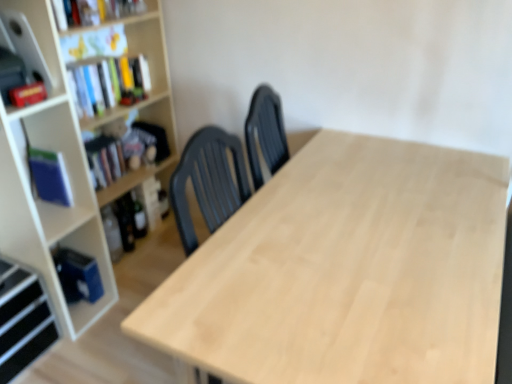
Question: Is hardcover book at left, the 2th book from the top, wider than blue matte book at left, which is the third book in top-to-bottom order?

Choices:
 (A) yes
 (B) no

Answer: (B)

Question: From a real-world perspective, does hardcover book at left, the second book ordered from the bottom, sit lower than blue matte book at left, arranged as the first book when ordered from the bottom?

Choices:
 (A) yes
 (B) no

Answer: (A)

Question: Can you confirm if hardcover book at left, the second book ordered from the bottom, is shorter than blue matte book at left, arranged as the first book when ordered from the bottom?

Choices:
 (A) yes
 (B) no

Answer: (A)

Question: From a real-world perspective, is hardcover book at left, the second book ordered from the bottom, located higher than blue matte book at left, which is the third book in top-to-bottom order?

Choices:
 (A) no
 (B) yes

Answer: (A)

Question: Is hardcover book at left, the second book ordered from the bottom, facing away from blue matte book at left, which is the third book in top-to-bottom order?

Choices:
 (A) no
 (B) yes

Answer: (A)

Question: From a real-world perspective, is wooden bookcase at left positioned above or below wooden bookshelf at upper left, the first shelf from the top?

Choices:
 (A) above
 (B) below

Answer: (B)

Question: In the image, is wooden bookcase at left on the left side or the right side of wooden bookshelf at upper left, which is the second shelf from left to right?

Choices:
 (A) right
 (B) left

Answer: (A)

Question: From their relative heights in the image, would you say wooden bookcase at left is taller or shorter than wooden bookshelf at upper left, the 2th shelf in the bottom-to-top sequence?

Choices:
 (A) tall
 (B) short

Answer: (A)

Question: Relative to wooden bookshelf at upper left, which is the second shelf from left to right, is wooden bookcase at left in front or behind?

Choices:
 (A) front
 (B) behind

Answer: (A)

Question: Relative to matte white cabinet at upper left, is wooden bookcase at left in front or behind?

Choices:
 (A) behind
 (B) front

Answer: (A)

Question: In terms of height, does wooden bookcase at left look taller or shorter compared to matte white cabinet at upper left?

Choices:
 (A) short
 (B) tall

Answer: (B)

Question: Is wooden bookcase at left to the left or to the right of matte white cabinet at upper left in the image?

Choices:
 (A) left
 (B) right

Answer: (B)

Question: From a real-world perspective, relative to matte white cabinet at upper left, is wooden bookcase at left vertically above or below?

Choices:
 (A) above
 (B) below

Answer: (B)

Question: From the image's perspective, relative to blue matte book at left, which is the third book in top-to-bottom order, is hardcover book at left, the 2th book from the top, above or below?

Choices:
 (A) below
 (B) above

Answer: (B)

Question: Is point (121, 173) closer or farther from the camera than point (31, 180)?

Choices:
 (A) closer
 (B) farther

Answer: (B)